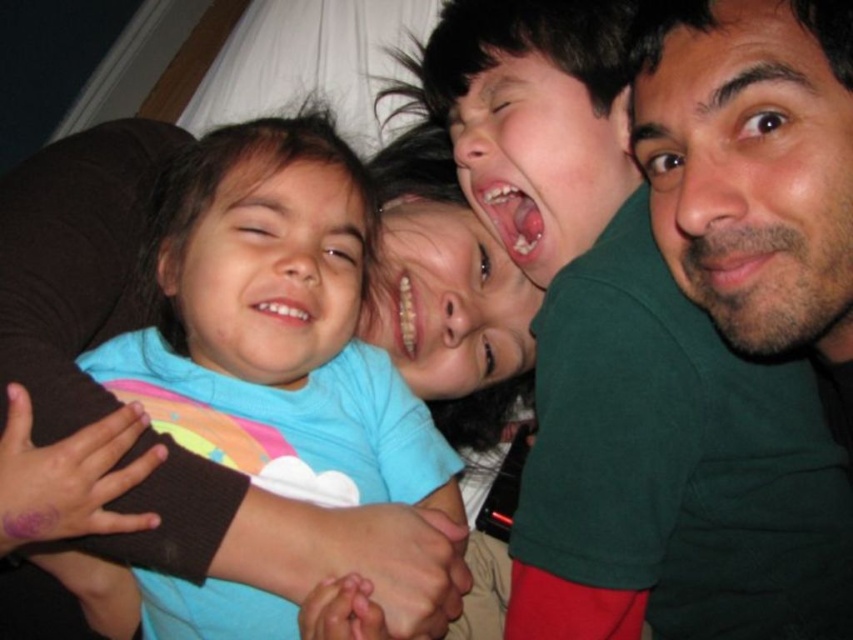
You are a photographer adjusting the camera focus. The green matte face at upper right and the smooth pink lips at center are both in the frame. Which one is closer to the camera?

The green matte face at upper right is in front of the smooth pink lips at center, so it is closer to the camera.

You are standing in a room with a green matte face at upper right located at point [752,163]. Can you see the green matte face at upper right from your current position?

Yes, the green matte face at upper right is located at point [752,163], so you can see it from your current position in the room.